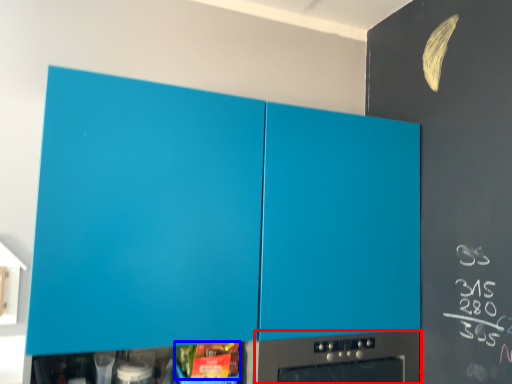
Question: Which of the following is the farthest to the observer, home appliance (highlighted by a red box) or food (highlighted by a blue box)?

Choices:
 (A) home appliance
 (B) food

Answer: (A)